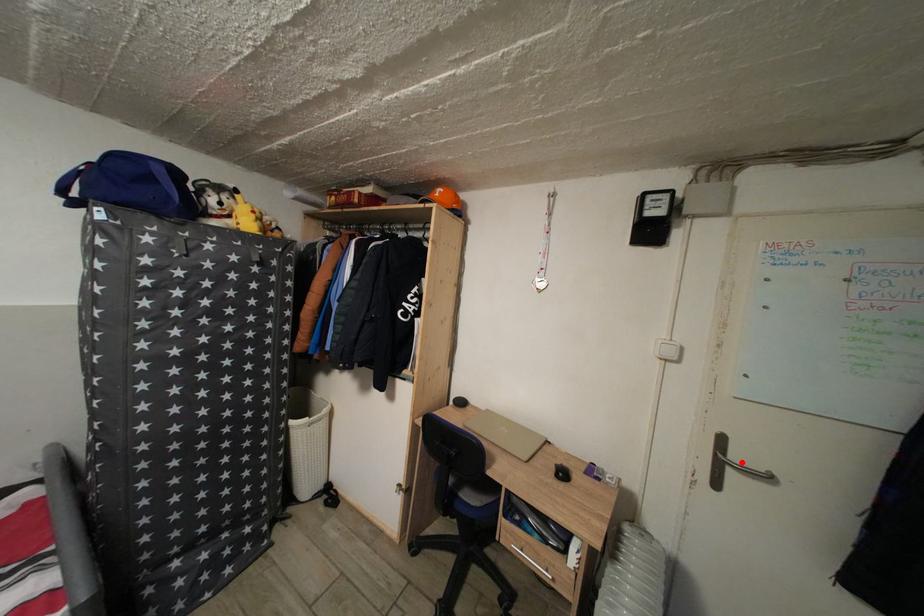
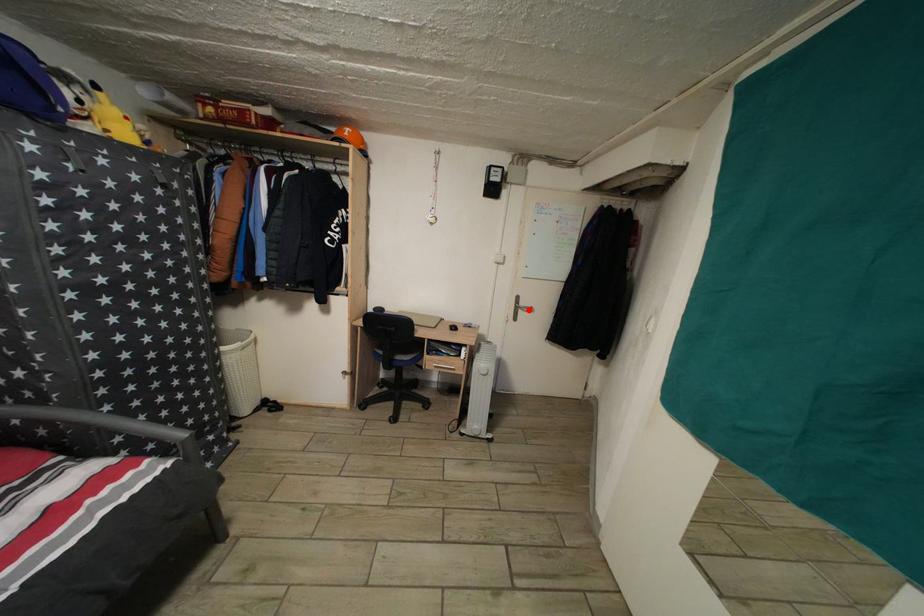
I am providing you with two images of the same scene from different viewpoints. A red point is marked on the first image and another point is marked on the second image. Does the point marked in image1 correspond to the same location as the one in image2?

Yes